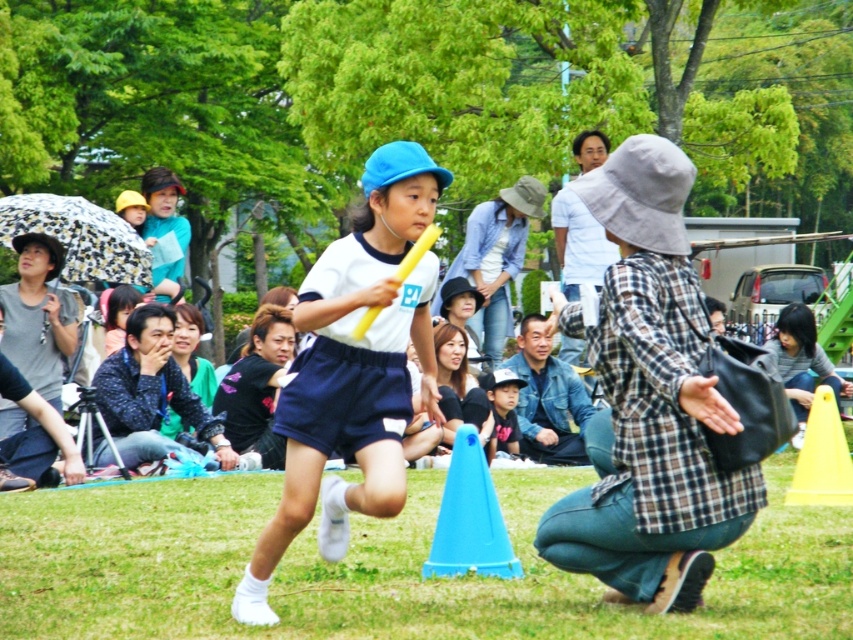
Question: Which of the following is the farthest from the observer?

Choices:
 (A) (454, 438)
 (B) (543, 576)

Answer: (A)

Question: Among these objects, which one is farthest from the camera?

Choices:
 (A) yellow plastic traffic cone at lower right
 (B) blue plastic traffic cone at center

Answer: (A)

Question: Does blue plastic traffic cone at center appear under yellow plastic traffic cone at lower right?

Choices:
 (A) no
 (B) yes

Answer: (A)

Question: Which object is farther from the camera taking this photo?

Choices:
 (A) yellow plastic traffic cone at lower right
 (B) green grass at center
 (C) matte black cap at center

Answer: (C)

Question: Is green grass at center closer to camera compared to yellow plastic traffic cone at lower right?

Choices:
 (A) no
 (B) yes

Answer: (A)

Question: In this image, where is yellow plastic traffic cone at lower right located relative to matte black cap at center?

Choices:
 (A) above
 (B) below

Answer: (B)